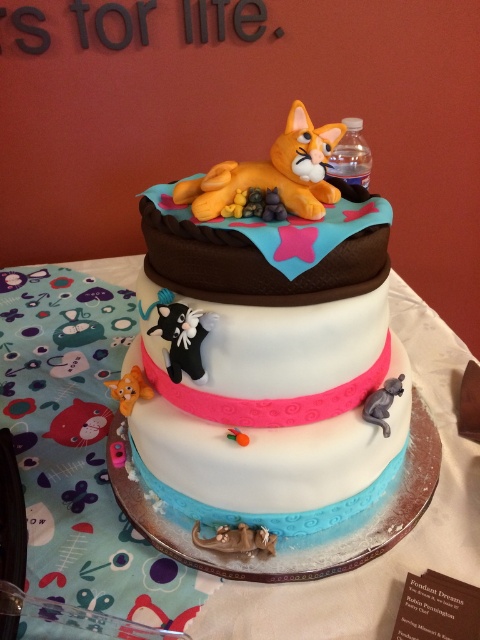
You are a guest at a birthday party and want to place a small candle on the tallest cat figure between the matte gray cat at lower right and the orange matte cat at lower left. Which cat should you choose?

The orange matte cat at lower left is taller than the matte gray cat at lower right, so you should place the candle on the orange matte cat at lower left.

You are a guest at a birthday party where this cake is displayed. You want to take a photo of the matte gray cat at lower right without moving the cake. Can you reach it with your hand to adjust its position? Please explain your reasoning.

The matte gray cat at lower right is 33.99 centimeters away from the viewer. Since an average human hand can typically reach about 30 centimeters without stretching, you might need to stretch slightly to adjust the matte gray cat at lower right.

You are a baker who needs to ensure that the cake tiers are stable. Considering the orange fondant cat at upper center and the orange matte cat at lower left, which cat should you be more cautious about in terms of stability?

The orange fondant cat at upper center has a greater height compared to the orange matte cat at lower left, so it is taller and might be less stable due to its height. You should be more cautious about the orange fondant cat at upper center.